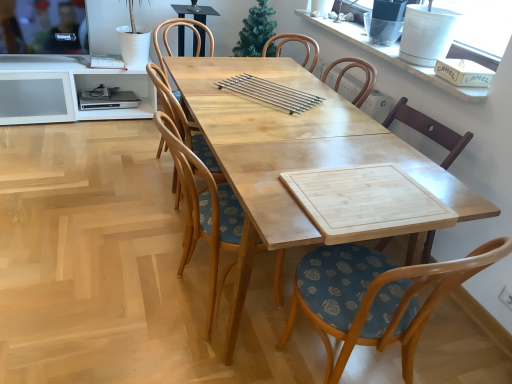
Question: Is wooden table at center situated inside wooden chair with floral cushion at center, placed as the 3th chair when sorted from back to front, or outside?

Choices:
 (A) outside
 (B) inside

Answer: (A)

Question: Is point (193, 96) closer or farther from the camera than point (403, 344)?

Choices:
 (A) farther
 (B) closer

Answer: (A)

Question: Based on their relative distances, which object is nearer to the wooden table at center?

Choices:
 (A) wooden chair with floral cushion at center, the first chair in the back-to-front sequence
 (B) wooden chair with floral cushion at center, the second chair positioned from the front
 (C) wooden chair with floral cushion at center, placed as the 3th chair when sorted from back to front
 (D) white ceramic vase at upper right
 (E) light wood table at center

Answer: (E)

Question: Which object is positioned closest to the wooden chair with floral cushion at center, the second chair positioned from the front?

Choices:
 (A) light wood table at center
 (B) white ceramic vase at upper right
 (C) wooden table at center
 (D) wooden chair with floral cushion at center, the first chair in the back-to-front sequence
 (E) wooden chair with floral cushion at center, which is the first chair in front-to-back order

Answer: (D)